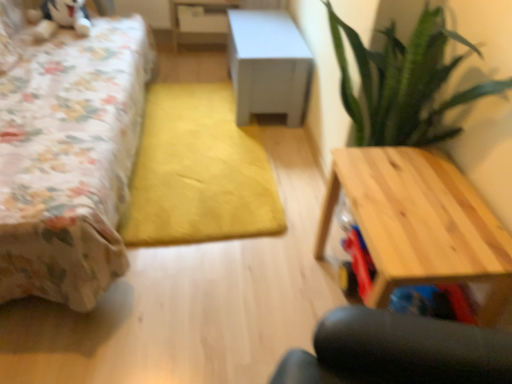
I want to click on vacant space in front of white matte cabinet at center, which ranks as the 2th table in bottom-to-top order, so click(x=214, y=139).